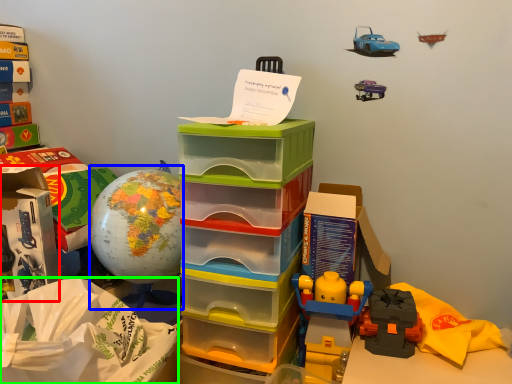
Question: Which object is the closest to the storage box (highlighted by a red box)? Choose among these: toy (highlighted by a blue box) or paper bag (highlighted by a green box).

Choices:
 (A) toy
 (B) paper bag

Answer: (A)